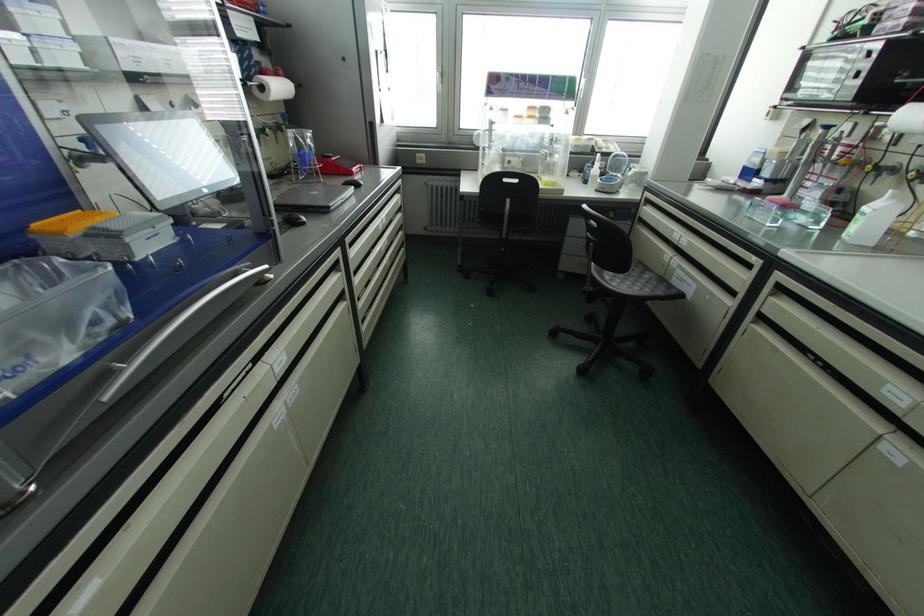
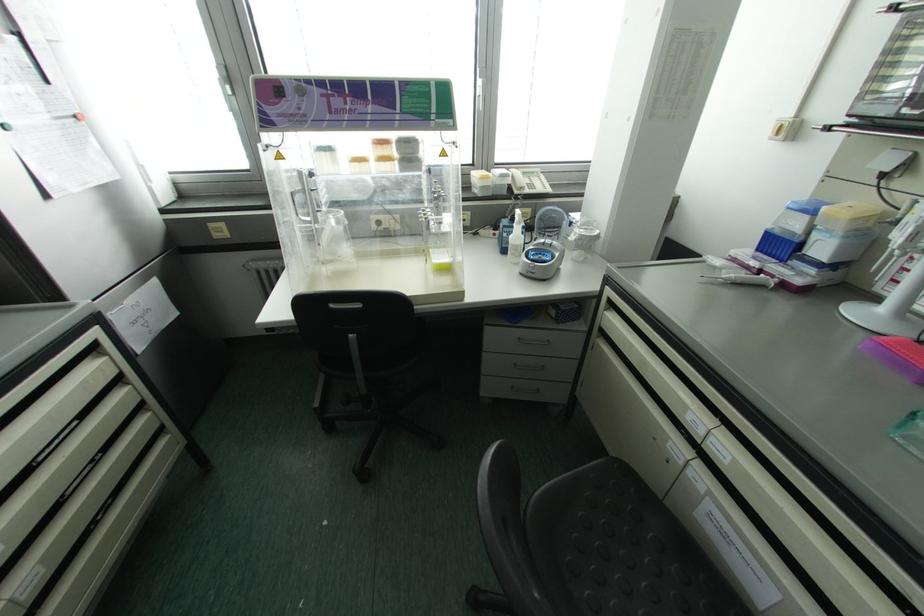
The point at (604, 190) is marked in the first image. Where is the corresponding point in the second image?

(536, 275)